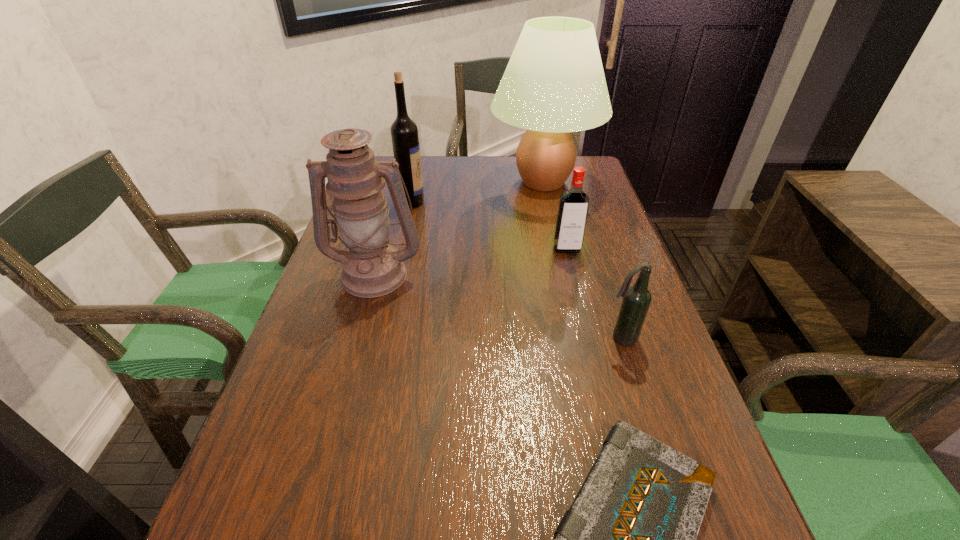
The image size is (960, 540). Identify the location of free spot at the left edge of the desktop. (373, 325).

Where is `free space at the right edge`? This screenshot has width=960, height=540. free space at the right edge is located at coordinates (606, 286).

Where is `vacant space that is in between the oil lamp and the vodka`? The image size is (960, 540). vacant space that is in between the oil lamp and the vodka is located at coordinates (471, 261).

Find the location of a particular element. The image size is (960, 540). unoccupied area between the second nearest object and the lampshade is located at coordinates (582, 260).

What are the coordinates of `vacant area that lies between the beer bottle and the tallest object` in the screenshot? It's located at (582, 260).

You are a GUI agent. You are given a task and a screenshot of the screen. Output one action in this format:
    pyautogui.click(x=<x>, y=<y>)
    Task: Click on the vacant space that's between the vodka and the oil lamp
    This screenshot has width=960, height=540.
    Given the screenshot: What is the action you would take?
    pyautogui.click(x=471, y=261)

The width and height of the screenshot is (960, 540). Identify the location of free area in between the lampshade and the vodka. (555, 215).

Locate which object ranks fifth in proximity to the oil lamp. Please provide its 2D coordinates. Your answer should be formatted as a tuple, i.e. [(x, y)], where the tuple contains the x and y coordinates of a point satisfying the conditions above.

[(636, 301)]

Identify which object is located as the nearest to the wine bottle. Please provide its 2D coordinates. Your answer should be formatted as a tuple, i.e. [(x, y)], where the tuple contains the x and y coordinates of a point satisfying the conditions above.

[(554, 84)]

The width and height of the screenshot is (960, 540). Find the location of `vacant region that satisfies the following two spatial constraints: 1. on the shade of the tallest object; 2. on the right side of the beer bottle`. vacant region that satisfies the following two spatial constraints: 1. on the shade of the tallest object; 2. on the right side of the beer bottle is located at coordinates (577, 338).